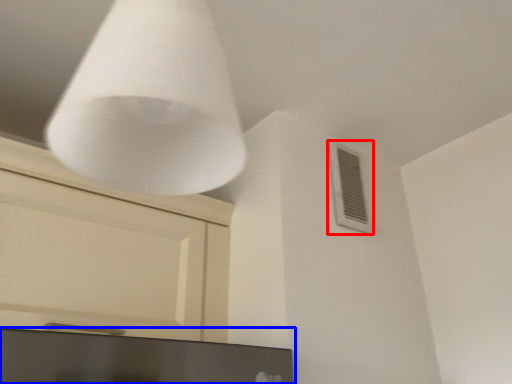
Question: Which object is further to the camera taking this photo, air conditioning (highlighted by a red box) or computer monitor (highlighted by a blue box)?

Choices:
 (A) air conditioning
 (B) computer monitor

Answer: (A)